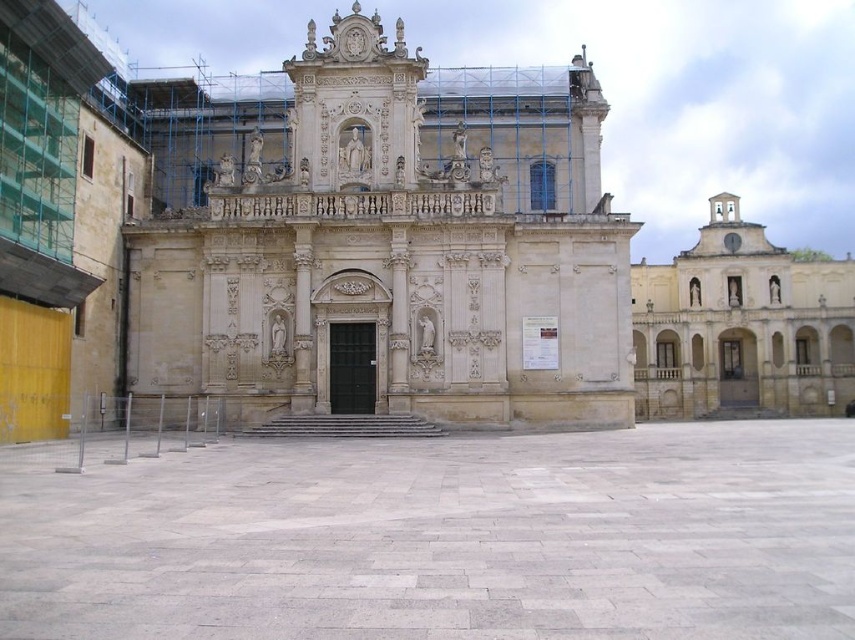
Question: Which of the following is the closest to the observer?

Choices:
 (A) (174, 483)
 (B) (333, 168)
 (C) (779, 356)

Answer: (A)

Question: Is gray stone courtyard at center closer to camera compared to beige stone church at center?

Choices:
 (A) no
 (B) yes

Answer: (B)

Question: Is the position of beige stone church at center more distant than that of light beige stone church at upper right?

Choices:
 (A) no
 (B) yes

Answer: (A)

Question: Among these objects, which one is nearest to the camera?

Choices:
 (A) gray stone courtyard at center
 (B) light beige stone church at upper right
 (C) beige stone church at center

Answer: (A)

Question: Which object appears closest to the camera in this image?

Choices:
 (A) beige stone church at center
 (B) light beige stone church at upper right
 (C) gray stone courtyard at center

Answer: (C)

Question: From the image, what is the correct spatial relationship of gray stone courtyard at center in relation to beige stone church at center?

Choices:
 (A) right
 (B) left

Answer: (A)